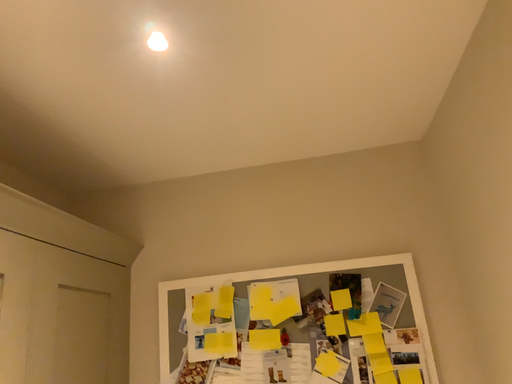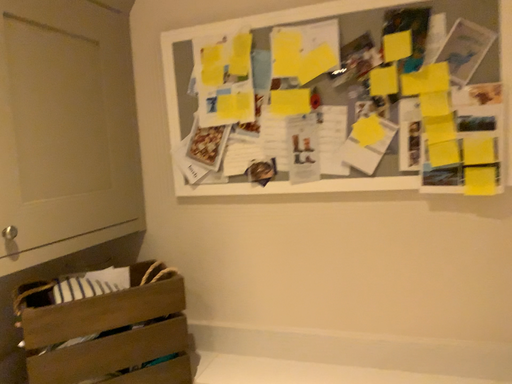
Question: How did the camera likely rotate when shooting the video?

Choices:
 (A) rotated right
 (B) rotated left

Answer: (B)